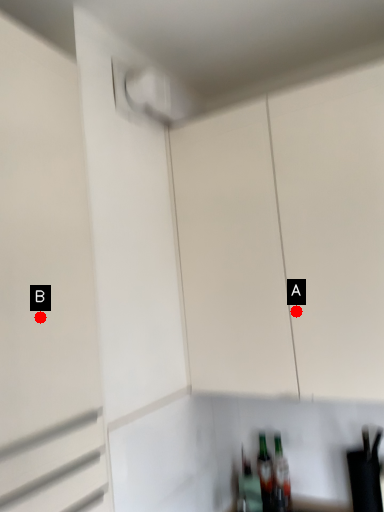
Question: Two points are circled on the image, labeled by A and B beside each circle. Which point is farther from the camera taking this photo?

Choices:
 (A) A is further
 (B) B is further

Answer: (A)